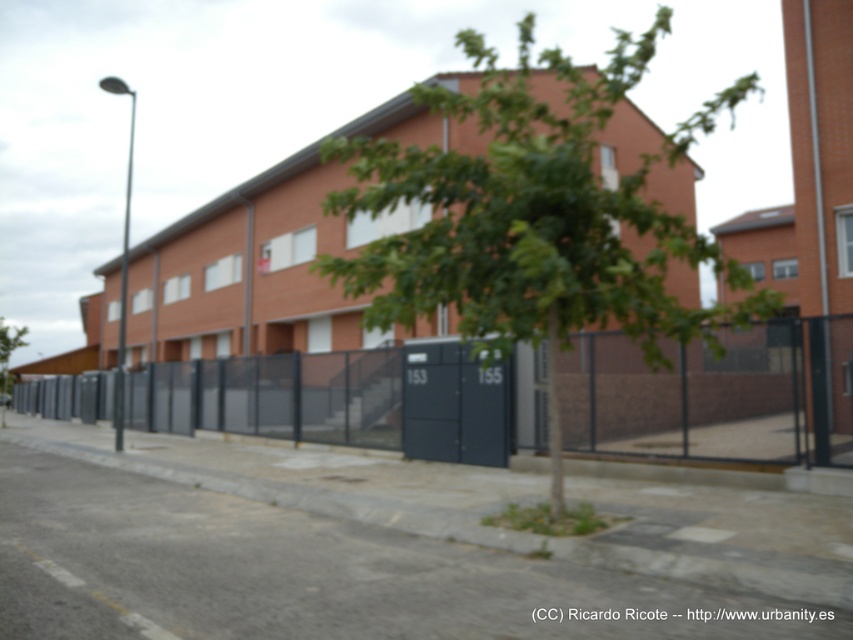
Does dark gray metal fence at center come behind green leafy tree at lower left?

No, dark gray metal fence at center is closer to the viewer.

Does dark gray metal fence at center appear over green leafy tree at lower left?

Incorrect, dark gray metal fence at center is not positioned above green leafy tree at lower left.

Is point (184, 417) less distant than point (3, 390)?

Yes, point (184, 417) is in front of point (3, 390).

Locate an element on the screen. This screenshot has width=853, height=640. dark gray metal fence at center is located at coordinates (717, 394).

Who is higher up, green leafy tree at center or dark gray metal fence at center?

green leafy tree at center is higher up.

Which is more to the right, green leafy tree at center or dark gray metal fence at center?

green leafy tree at center

You are a GUI agent. You are given a task and a screenshot of the screen. Output one action in this format:
    pyautogui.click(x=<x>, y=<y>)
    Task: Click on the green leafy tree at center
    This screenshot has height=640, width=853.
    Given the screenshot: What is the action you would take?
    pyautogui.click(x=534, y=218)

Between green leafy tree at center and green leafy tree at lower left, which one is positioned lower?

green leafy tree at lower left is lower down.

Is green leafy tree at center above green leafy tree at lower left?

Yes.

Where is `green leafy tree at center`? green leafy tree at center is located at coordinates (534, 218).